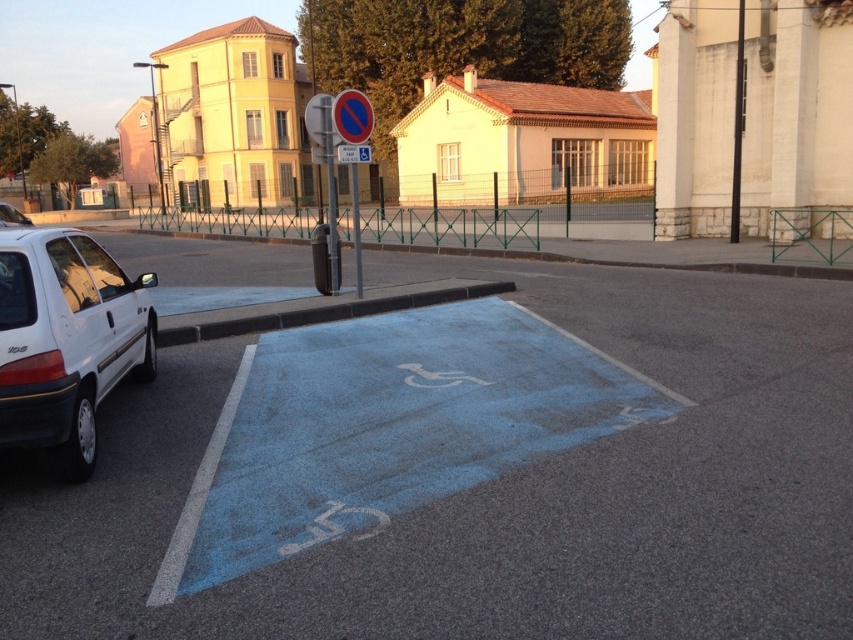
Question: Which of these objects is positioned closest to the white matte car at left?

Choices:
 (A) blue asphalt bike lane at lower left
 (B) metallic reflective no parking sign at upper center
 (C) blue painted sign at center

Answer: (C)

Question: Can you confirm if white matte hatchback at left is smaller than white matte car at left?

Choices:
 (A) no
 (B) yes

Answer: (B)

Question: Estimate the real-world distances between objects in this image. Which object is closer to the blue painted sign at center?

Choices:
 (A) blue asphalt bike lane at lower left
 (B) metallic reflective no parking sign at upper center
 (C) white matte car at left
 (D) white matte hatchback at left

Answer: (B)

Question: Which of these objects is positioned farthest from the white matte car at left?

Choices:
 (A) white matte hatchback at left
 (B) metallic reflective no parking sign at upper center

Answer: (B)

Question: Is blue asphalt bike lane at lower left smaller than metallic reflective no parking sign at upper center?

Choices:
 (A) no
 (B) yes

Answer: (B)

Question: Is the position of blue asphalt bike lane at lower left more distant than that of blue painted sign at center?

Choices:
 (A) no
 (B) yes

Answer: (A)